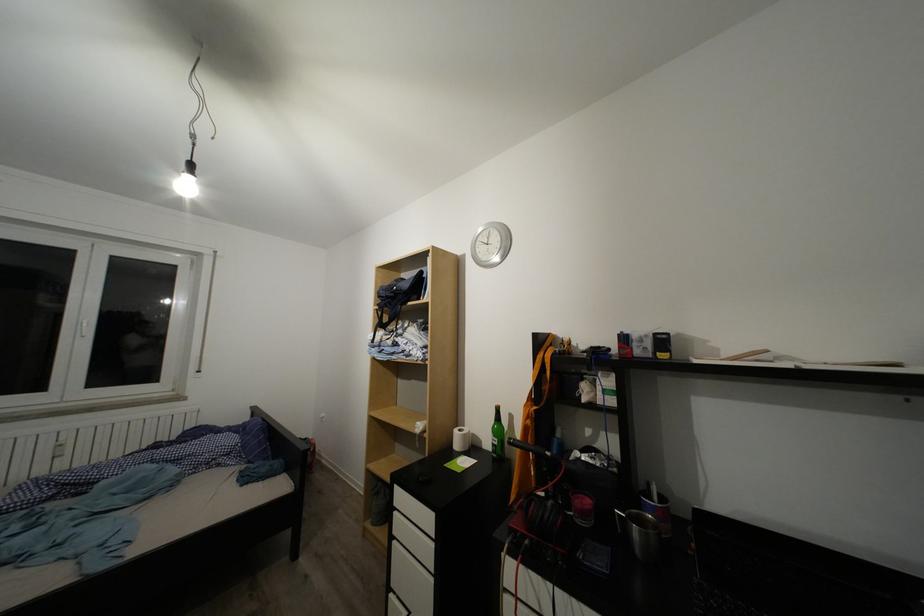
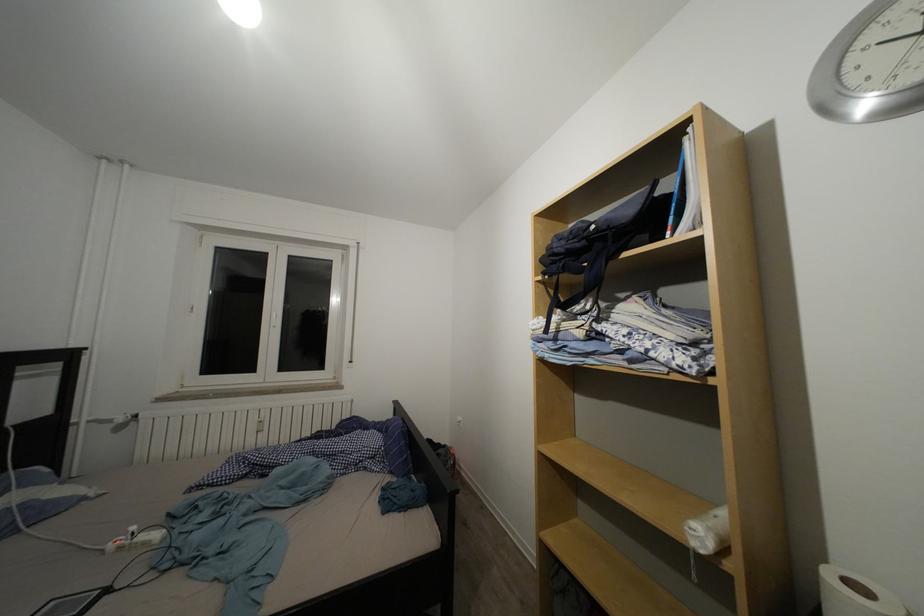
In the second image, find the point that corresponds to [464,437] in the first image.

(837, 584)